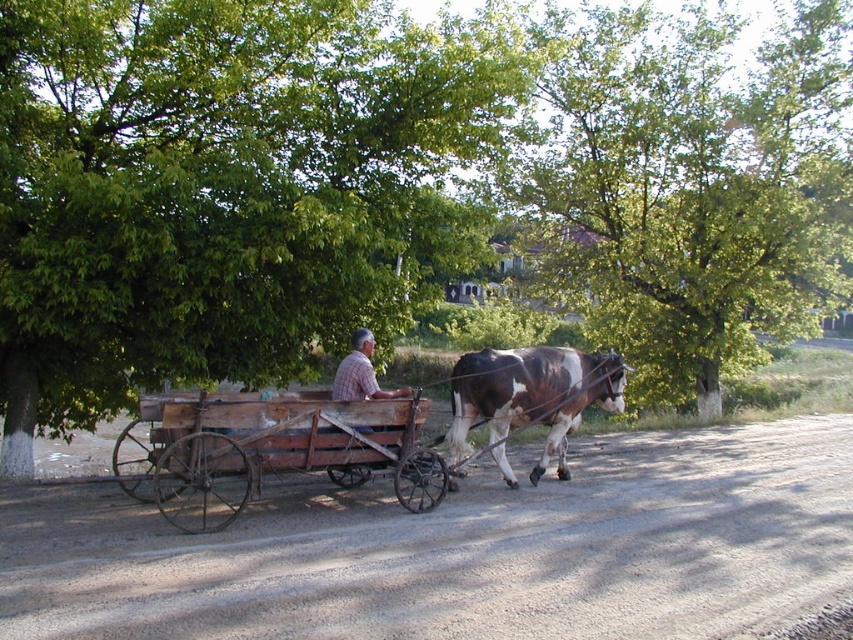
You are a traveler approaching the rustic wood wagon at center from the direction of the green leafy tree at upper left. Which side of the wagon will you see first as you approach?

Since the green leafy tree at upper left is to the left of the rustic wood wagon at center, you will first see the left side of the rustic wood wagon at center as you approach from that direction.

In the scene shown: You are a traveler on a dirt road and see a green leafy tree at center and a brown and white fur at center. Which object is bigger?

The green leafy tree at center is larger in size than the brown and white fur at center.